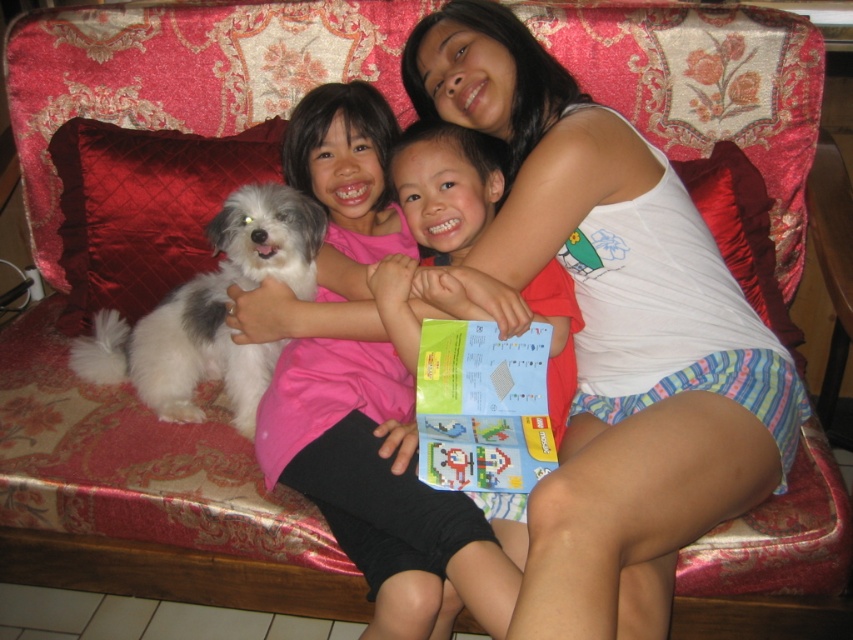
Is point (567, 83) positioned after point (798, 356)?

No, it is in front of (798, 356).

Between point (677, 401) and point (714, 157), which one is positioned behind?

The point (714, 157) is behind.

Identify the location of white cotton tank top at upper center. (610, 332).

Which is more to the left, pink fabric dress at center or red satin pillow at upper right?

From the viewer's perspective, pink fabric dress at center appears more on the left side.

Does point (363, 145) come closer to viewer compared to point (717, 152)?

That is True.

Find the location of a particular element. This screenshot has height=640, width=853. pink fabric dress at center is located at coordinates (378, 488).

At what (x,y) coordinates should I click in order to perform the action: click on white fluffy dog at left. Please return your answer as a coordinate pair (x, y). The image size is (853, 640). Looking at the image, I should click on (212, 310).

Does white fluffy dog at left have a lesser height compared to pink fabric at center?

Correct, white fluffy dog at left is not as tall as pink fabric at center.

Measure the distance between white fluffy dog at left and camera.

white fluffy dog at left and camera are 1.28 meters apart.

Find the location of a particular element. Image resolution: width=853 pixels, height=640 pixels. white fluffy dog at left is located at coordinates (212, 310).